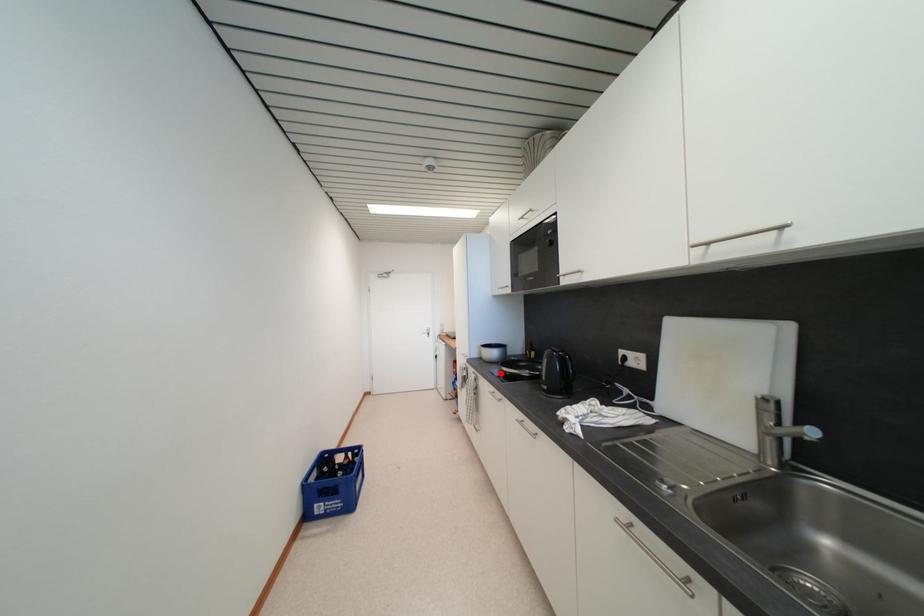
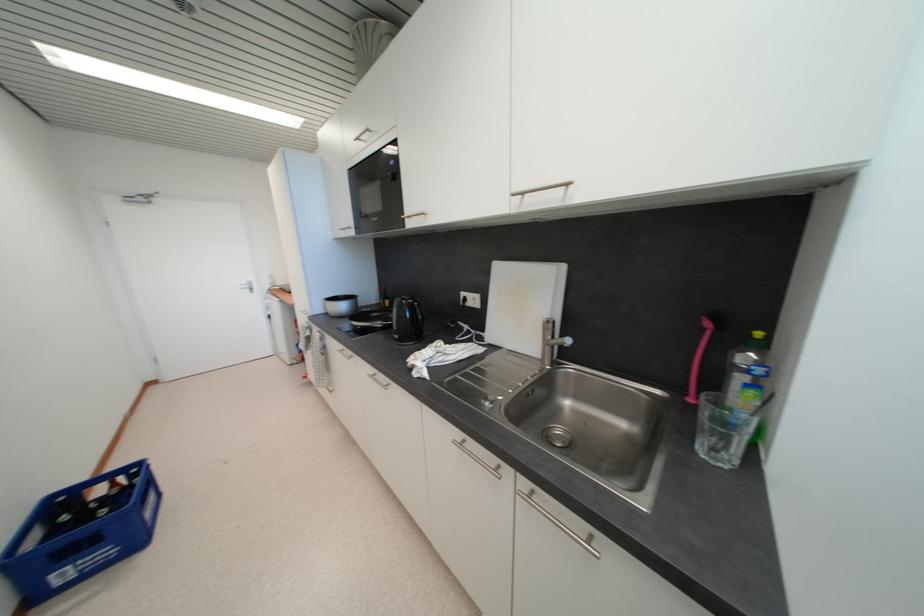
The point at the highlighted location is marked in the first image. Where is the corresponding point in the second image?

(351, 328)